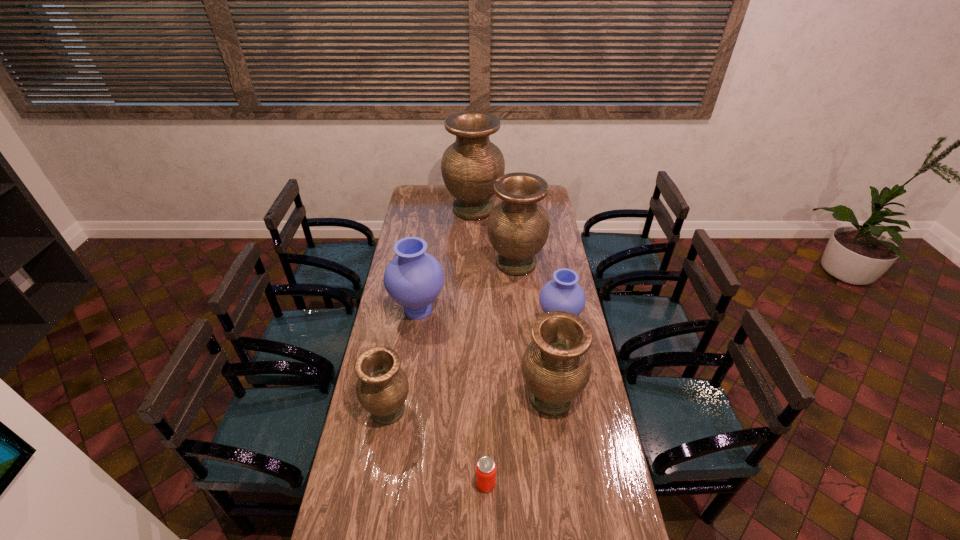
Where is `the farthest green vase`? the farthest green vase is located at coordinates coord(470,166).

This screenshot has height=540, width=960. What are the coordinates of `the farthest vase` in the screenshot? It's located at (470, 166).

The image size is (960, 540). I want to click on the third smallest green vase, so click(x=518, y=227).

Locate an element on the screen. the second farthest vase is located at coordinates (518, 227).

I want to click on the bigger blue vase, so [414, 278].

Where is `the third biggest green vase`? the third biggest green vase is located at coordinates (556, 367).

You are a GUI agent. You are given a task and a screenshot of the screen. Output one action in this format:
    pyautogui.click(x=<x>, y=<y>)
    Task: Click on the smallest green vase
    
    Given the screenshot: What is the action you would take?
    pyautogui.click(x=382, y=388)

Where is `the smaller blue vase`? Image resolution: width=960 pixels, height=540 pixels. the smaller blue vase is located at coordinates (563, 293).

This screenshot has width=960, height=540. I want to click on the shortest object, so click(485, 468).

Find the location of a particular element. This screenshot has height=540, width=960. beer can is located at coordinates (485, 468).